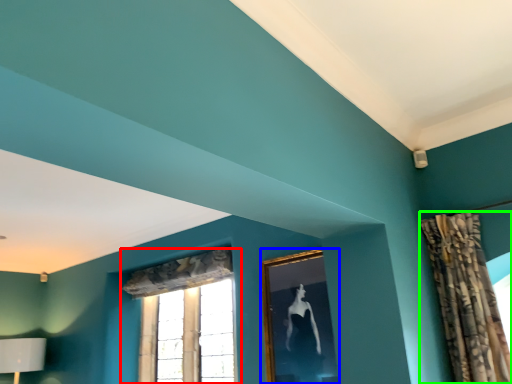
Question: Considering the real-world distances, which object is closest to window (highlighted by a red box)? picture frame (highlighted by a blue box) or curtain (highlighted by a green box).

Choices:
 (A) picture frame
 (B) curtain

Answer: (A)